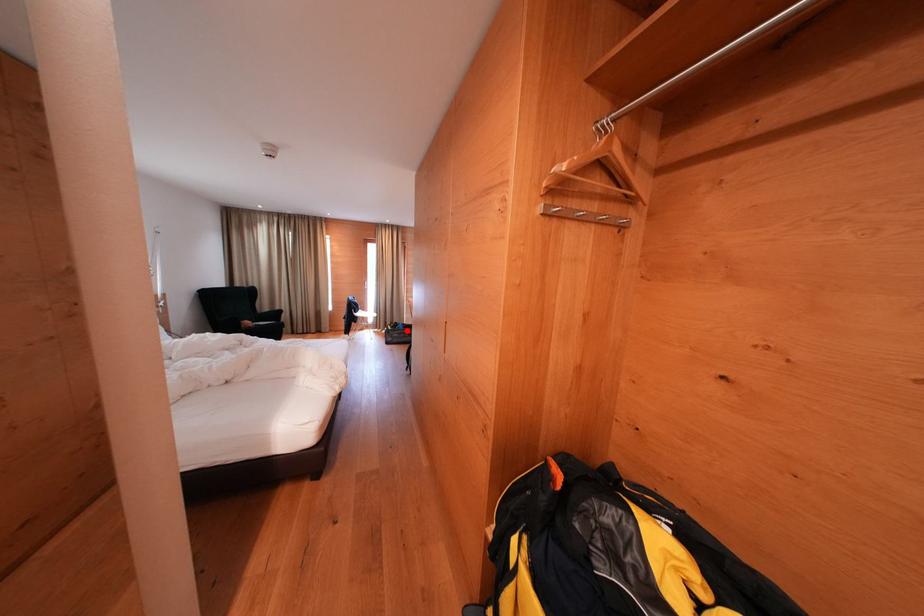
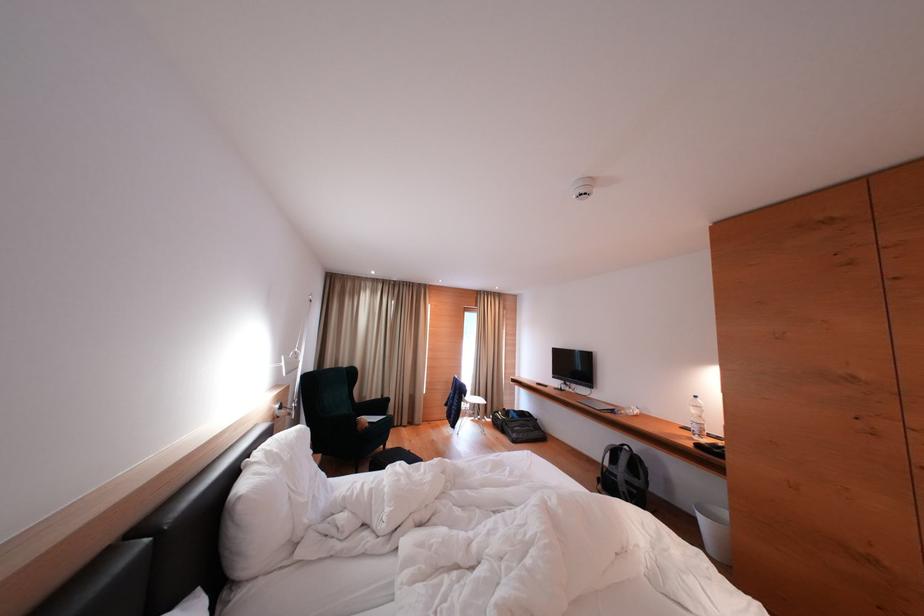
Question: I am providing you with two images of the same scene from different viewpoints. Given a red point in image1, look at the same physical point in image2. Is it:

Choices:
 (A) Closer to the viewpoint
 (B) Farther from the viewpoint

Answer: (A)